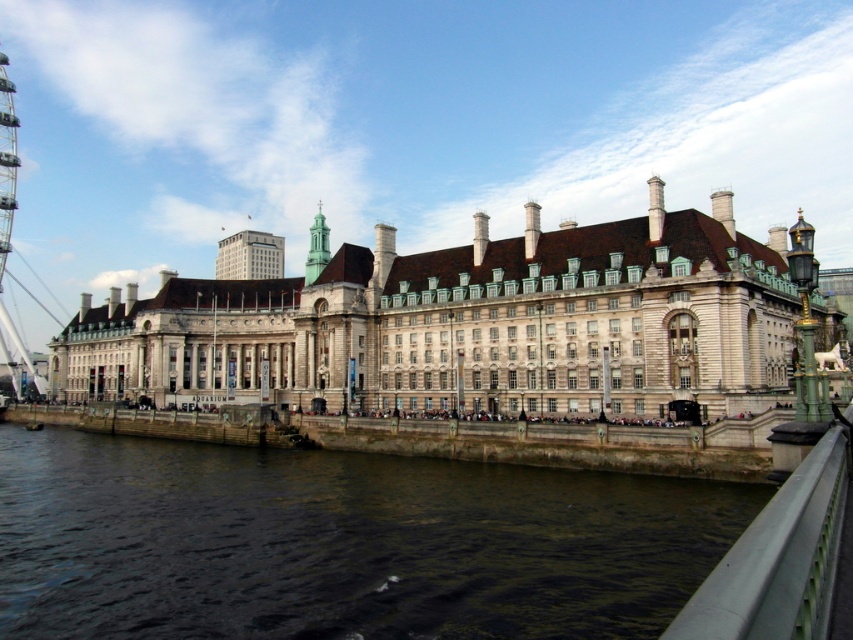
You are a tourist standing on the riverbank and want to take a photo of the green stone tower at center without the dark brown water at lower center appearing too prominently. Based on their relative heights, how should you adjust your camera angle?

Since the dark brown water at lower center is shorter than the green stone tower at center, you can angle your camera upwards to focus on the tower while minimizing the water in the frame.

You are standing on the riverbank looking at the historic building. You see the dark brown water at lower center and the green stone tower at center. Which object is positioned to the right of the other?

The dark brown water at lower center is to the right of the green stone tower at center.